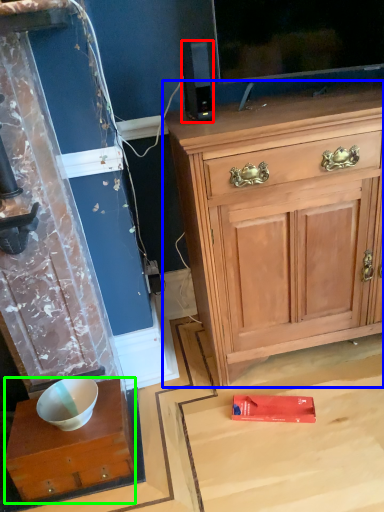
Question: Which object is the farthest from loudspeaker (highlighted by a red box)? Choose among these: cabinetry (highlighted by a blue box) or desk (highlighted by a green box).

Choices:
 (A) cabinetry
 (B) desk

Answer: (B)